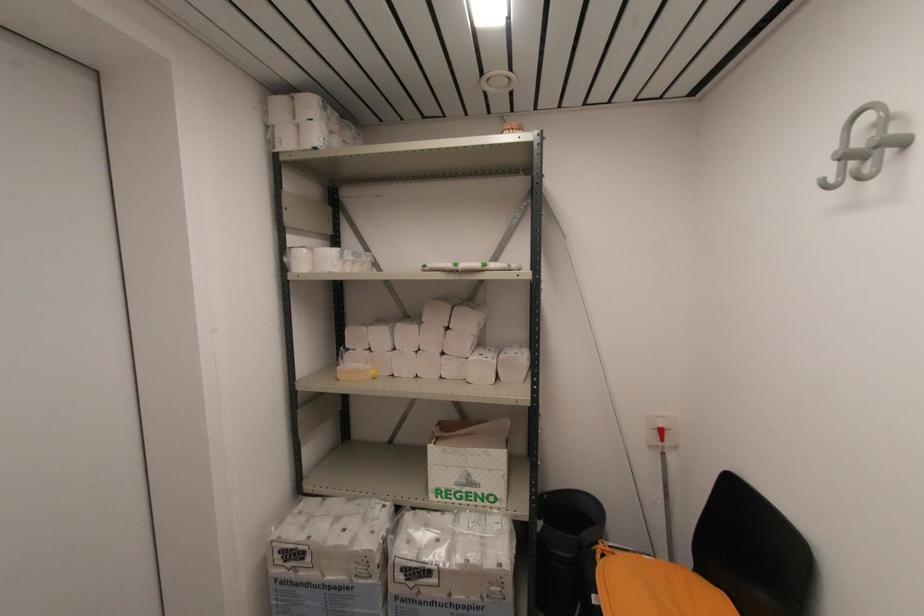
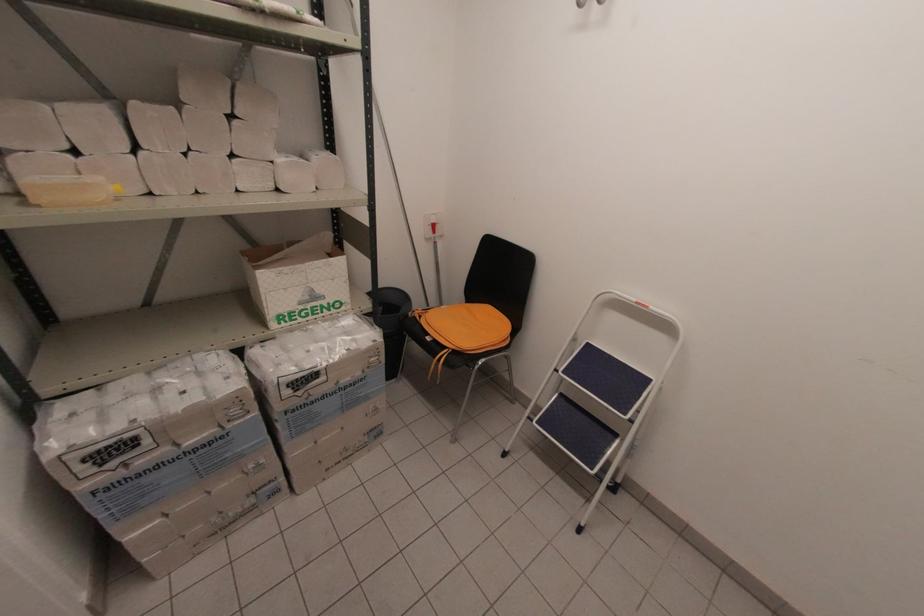
The point at (511, 570) is marked in the first image. Where is the corresponding point in the second image?

(383, 341)